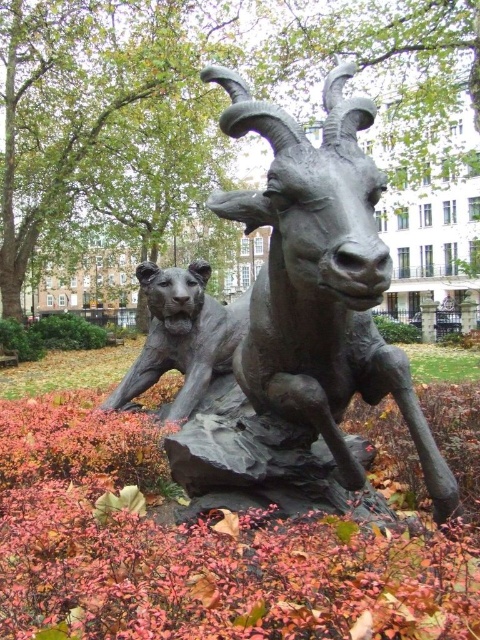
Between bronze statue at center and bronze textured goat at center, which one appears on the left side from the viewer's perspective?

bronze textured goat at center is more to the left.

Who is more distant from viewer, (203, 616) or (319, 499)?

Point (319, 499)

Describe the element at coordinates (188, 540) in the screenshot. I see `bronze statue at center` at that location.

Image resolution: width=480 pixels, height=640 pixels. I want to click on bronze statue at center, so click(x=188, y=540).

Can you confirm if bronze textured goat at center is positioned below shiny bronze tiger at center?

No, bronze textured goat at center is not below shiny bronze tiger at center.

Who is more forward, (190,282) or (240,332)?

Point (190,282) is more forward.

Where is `bronze textured goat at center`? This screenshot has height=640, width=480. bronze textured goat at center is located at coordinates (290, 330).

Is bronze statue at center smaller than shiny bronze tiger at center?

No, bronze statue at center is not smaller than shiny bronze tiger at center.

Which is more to the right, bronze statue at center or shiny bronze tiger at center?

From the viewer's perspective, bronze statue at center appears more on the right side.

This screenshot has width=480, height=640. I want to click on bronze statue at center, so click(188, 540).

Find the location of a particular element. The width and height of the screenshot is (480, 640). bronze statue at center is located at coordinates (188, 540).